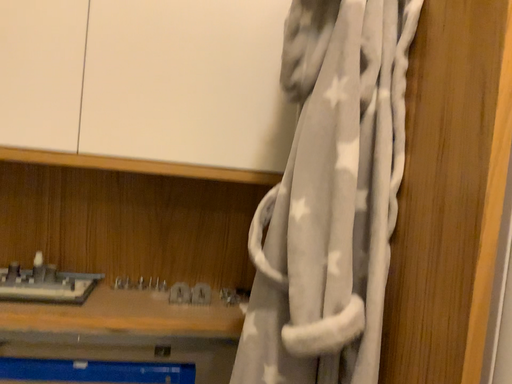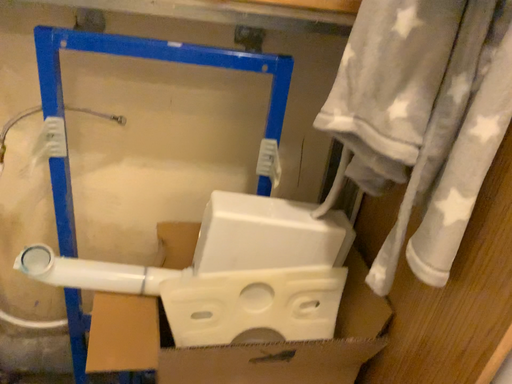
Question: Which way did the camera rotate in the video?

Choices:
 (A) rotated left
 (B) rotated right

Answer: (A)